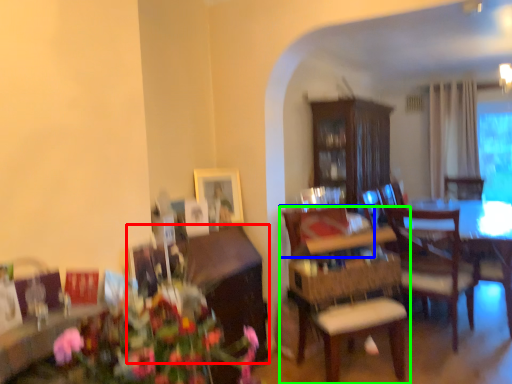
Question: Which object is the farthest from cabinetry (highlighted by a red box)? Choose among these: chair (highlighted by a blue box) or chair (highlighted by a green box).

Choices:
 (A) chair
 (B) chair

Answer: (B)